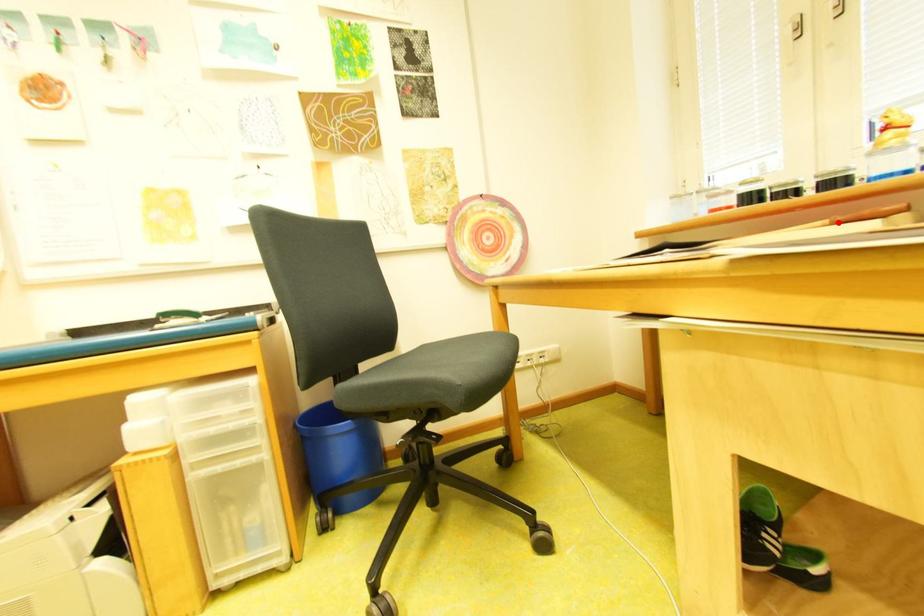
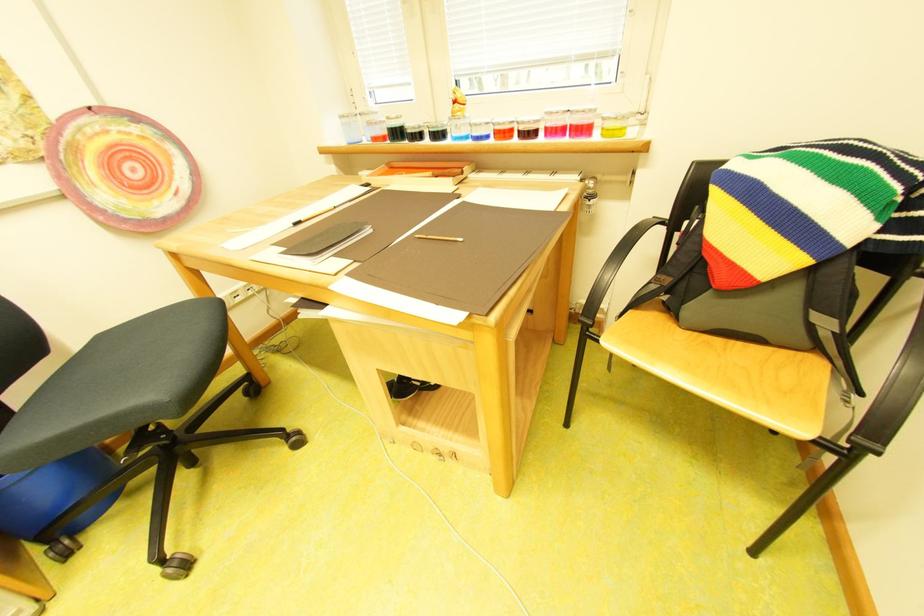
The point at the highlighted location is marked in the first image. Where is the corresponding point in the second image?

(441, 175)